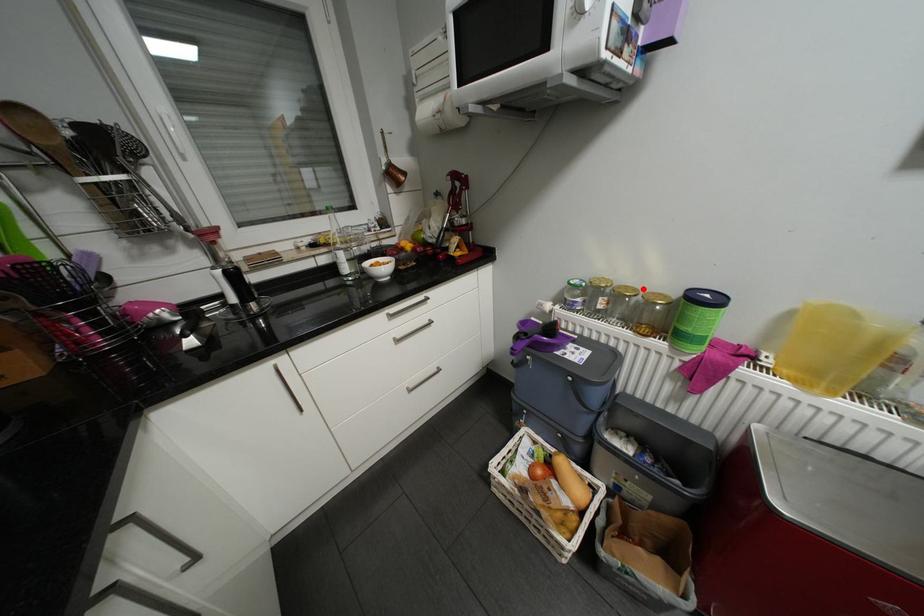
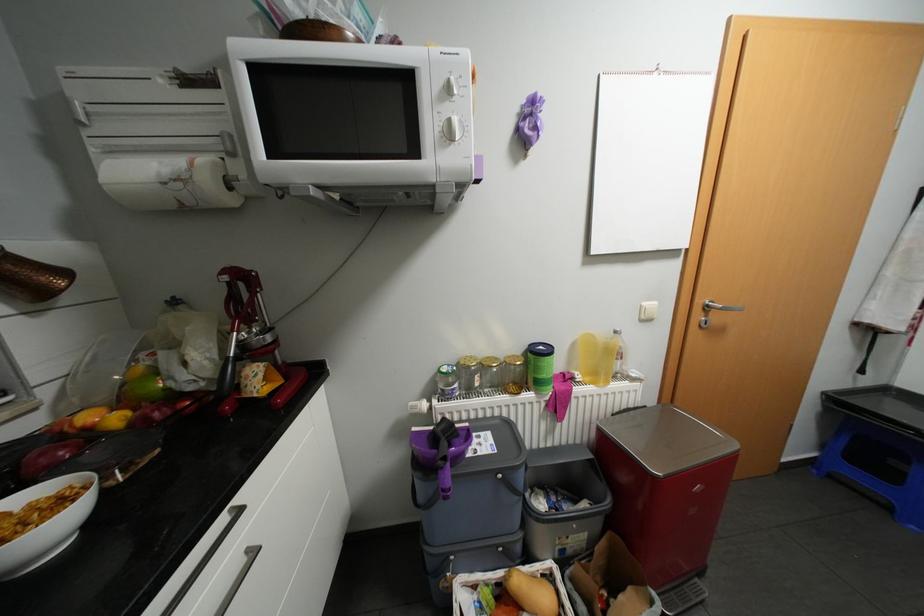
Find the pixel in the second image that matches the highlighted location in the first image.

(504, 358)